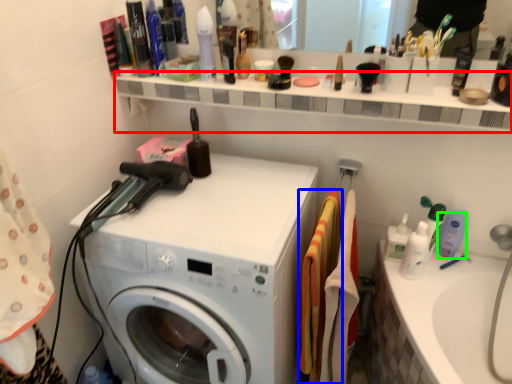
Question: Estimate the real-world distances between objects in this image. Which object is farther from shelve (highlighted by a red box), material (highlighted by a blue box) or cleaning product (highlighted by a green box)?

Choices:
 (A) material
 (B) cleaning product

Answer: (B)